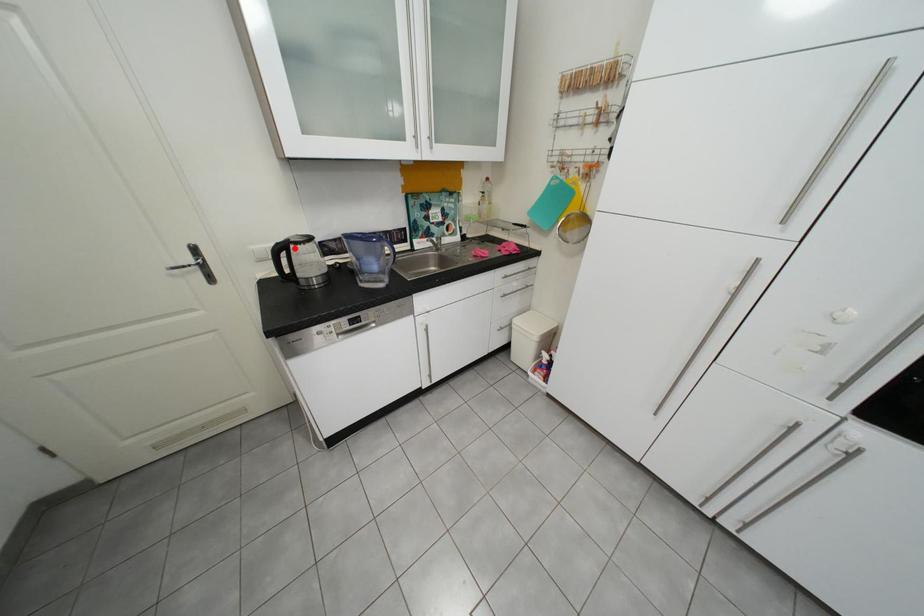
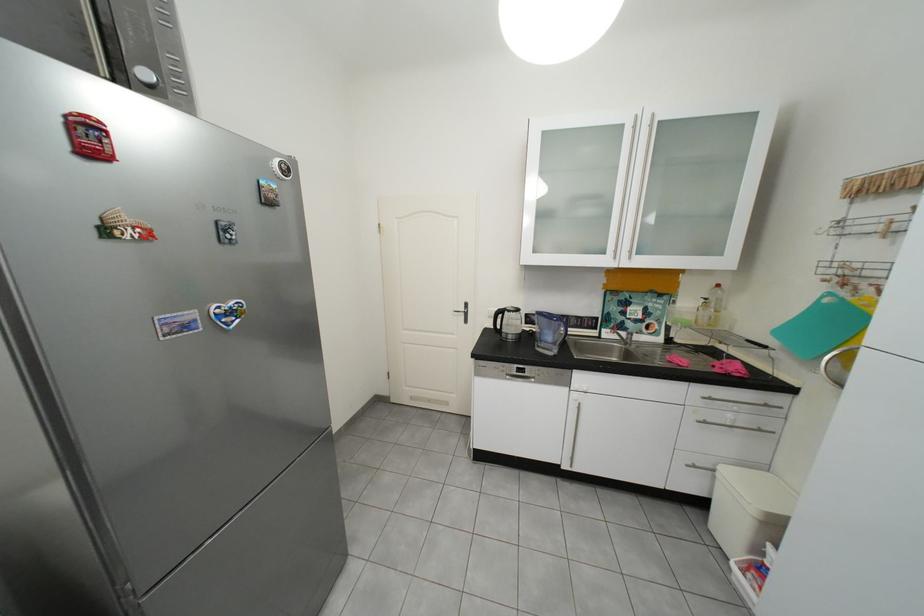
Question: I am providing you with two images of the same scene from different viewpoints. Given a red point in image1, look at the same physical point in image2. Is it:

Choices:
 (A) Closer to the viewpoint
 (B) Farther from the viewpoint

Answer: (B)